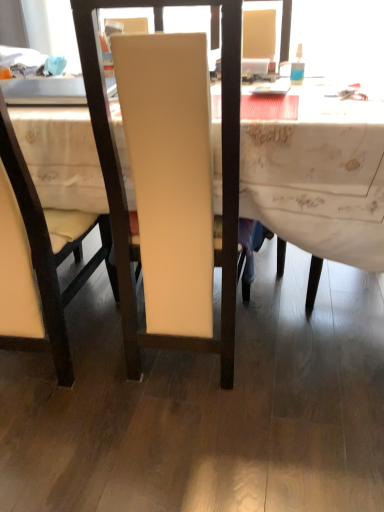
Question: From a real-world perspective, relative to matte cream chair at center, which is the second chair from right to left, is matte white chair at center, arranged as the 2th chair when viewed from the left, vertically above or below?

Choices:
 (A) below
 (B) above

Answer: (A)

Question: Choose the correct answer: Is matte white chair at center, arranged as the 2th chair when viewed from the left, inside matte cream chair at center, the 1th chair in the left-to-right sequence, or outside it?

Choices:
 (A) outside
 (B) inside

Answer: (A)

Question: Which object is the closest to the matte white chair at center, marked as the 1th chair in a right-to-left arrangement?

Choices:
 (A) white fabric desk at center
 (B) translucent plastic bottle at upper right
 (C) matte cream chair at center, which is the second chair from right to left

Answer: (A)

Question: Which object is positioned farthest from the white fabric desk at center?

Choices:
 (A) translucent plastic bottle at upper right
 (B) matte cream chair at center, the 1th chair in the left-to-right sequence
 (C) matte white chair at center, arranged as the 2th chair when viewed from the left

Answer: (B)